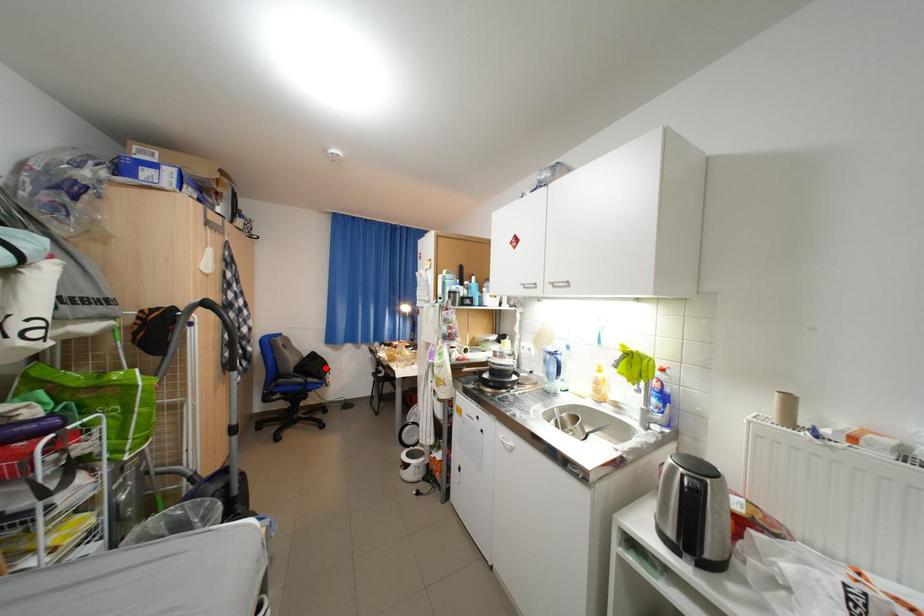
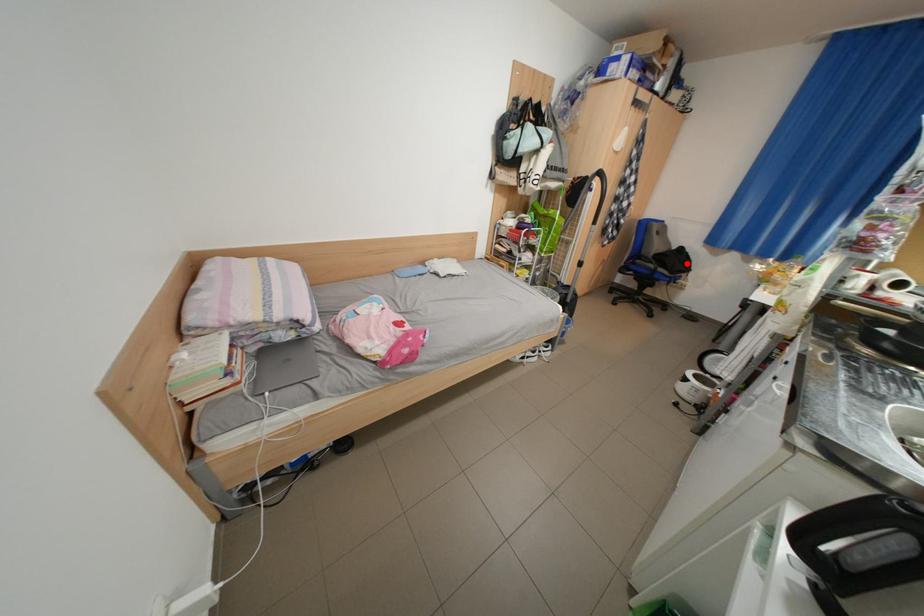
I am providing you with two images of the same scene from different viewpoints. A red point is marked on the first image and another point is marked on the second image. Does the point marked in image1 correspond to the same location as the one in image2?

Yes